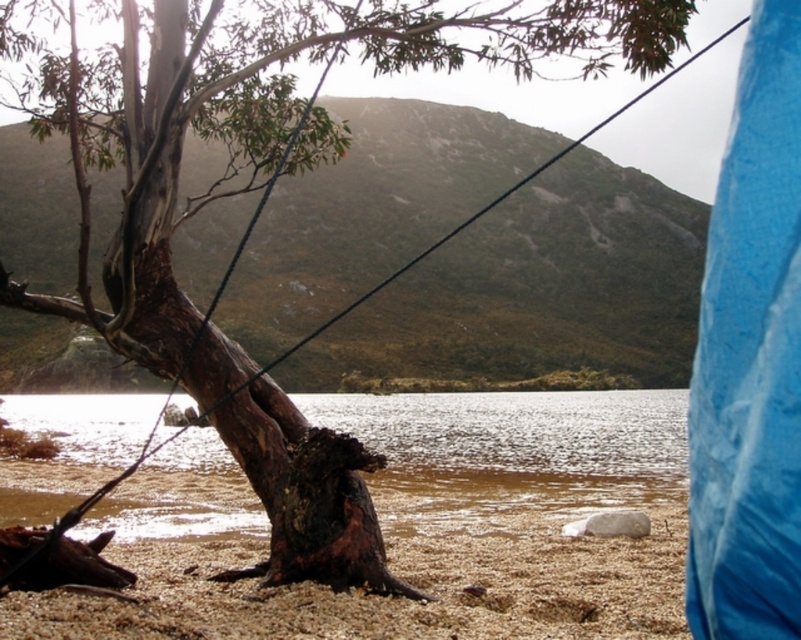
Between point (602, 488) and point (302, 605), which one is positioned behind?

The point (602, 488) is more distant.

Which of these two, brown/muddy water at center or brown sandy beach at lower center, stands shorter?

brown sandy beach at lower center is shorter.

Between point (139, 492) and point (19, 608), which one is positioned behind?

Positioned behind is point (139, 492).

This screenshot has height=640, width=801. I want to click on brown/muddy water at center, so click(512, 451).